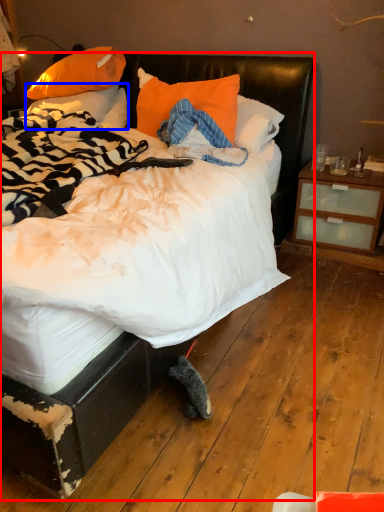
Question: Which object is further to the camera taking this photo, bed (highlighted by a red box) or pillow (highlighted by a blue box)?

Choices:
 (A) bed
 (B) pillow

Answer: (B)